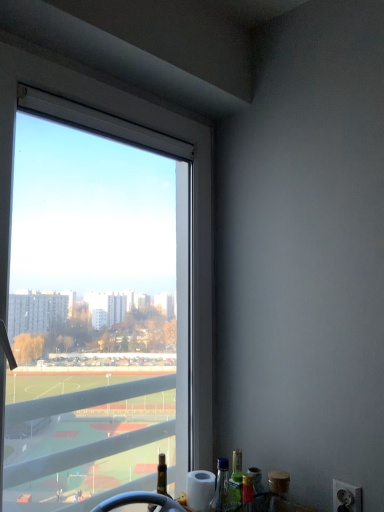
Question: Considering the positions of transparent glass window at upper left and white plastic power outlet at lower right in the image, is transparent glass window at upper left bigger or smaller than white plastic power outlet at lower right?

Choices:
 (A) small
 (B) big

Answer: (B)

Question: In the image, is transparent glass window at upper left positioned in front of or behind white plastic power outlet at lower right?

Choices:
 (A) front
 (B) behind

Answer: (A)

Question: Which of these objects is positioned closest to the white plastic power outlet at lower right?

Choices:
 (A) green glass bottle at lower right
 (B) transparent glass window at upper left

Answer: (A)

Question: Estimate the real-world distances between objects in this image. Which object is closer to the transparent glass window at upper left?

Choices:
 (A) white plastic power outlet at lower right
 (B) green glass bottle at lower right

Answer: (B)